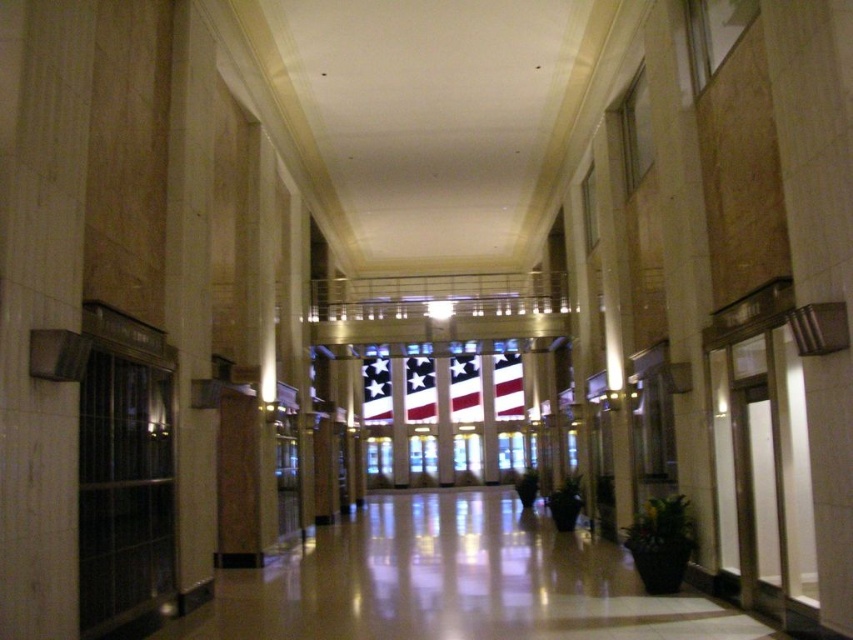
You are standing in the grand building and want to walk towards the white fabric flag at center. Which direction should you move relative to the white glossy floor at center?

To reach the white fabric flag at center, you should move away from the white glossy floor at center since the floor is closer to you than the flag.